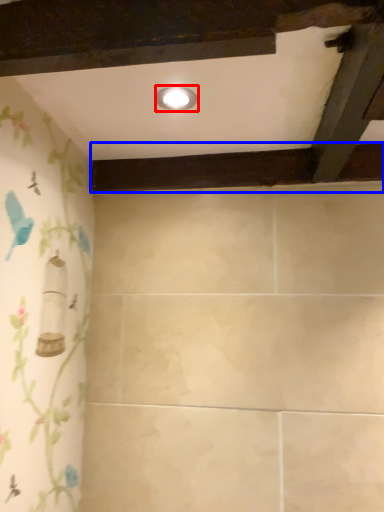
Question: Which object appears farthest to the camera in this image, light fixture (highlighted by a red box) or plank (highlighted by a blue box)?

Choices:
 (A) light fixture
 (B) plank

Answer: (B)